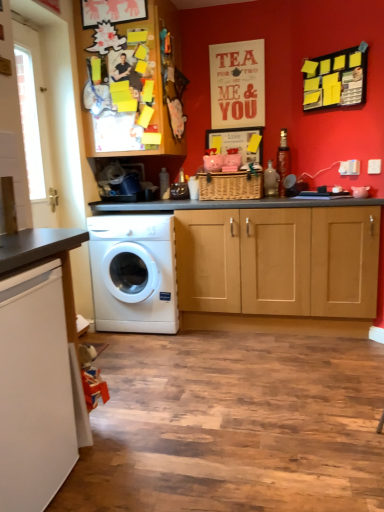
Question: Relative to white glossy washing machine at center, is white glossy countertop at lower left in front or behind?

Choices:
 (A) behind
 (B) front

Answer: (B)

Question: Considering the positions of white glossy countertop at lower left and white glossy washing machine at center in the image, is white glossy countertop at lower left bigger or smaller than white glossy washing machine at center?

Choices:
 (A) big
 (B) small

Answer: (B)

Question: Considering the real-world distances, which object is closest to the white glossy countertop at lower left?

Choices:
 (A) wooden cabinet at upper left
 (B) white glossy washing machine at center
 (C) yellow sticky notes on black board at upper right

Answer: (B)

Question: Which of these objects is positioned closest to the yellow sticky notes on black board at upper right?

Choices:
 (A) white glossy washing machine at center
 (B) white glossy countertop at lower left
 (C) wooden cabinet at upper left

Answer: (C)